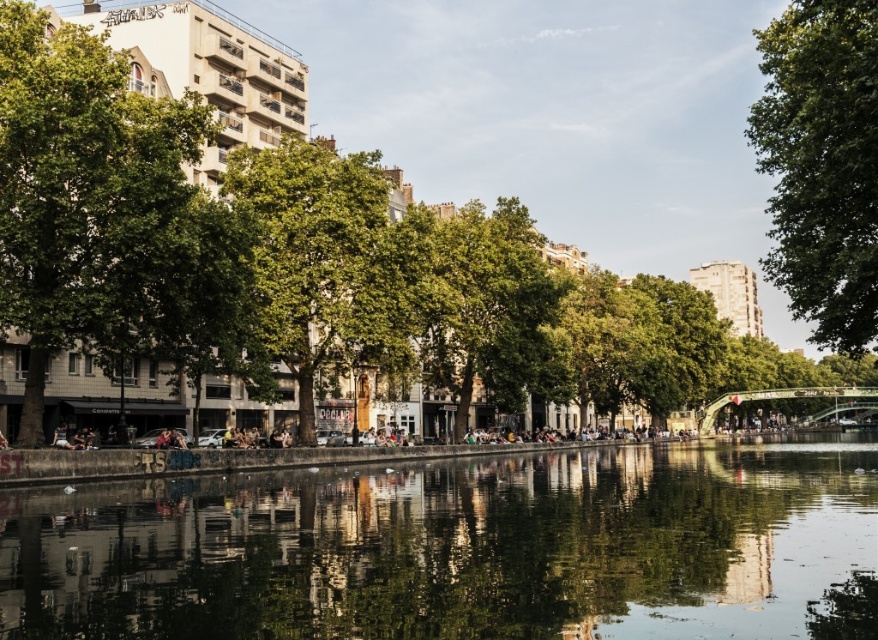
Which of these two, green leafy tree at left or green leafy tree at upper right, stands shorter?

green leafy tree at left

The image size is (878, 640). Describe the element at coordinates (98, 208) in the screenshot. I see `green leafy tree at left` at that location.

Does point (63, 224) come in front of point (839, 198)?

Yes, point (63, 224) is in front of point (839, 198).

Locate an element on the screen. This screenshot has height=640, width=878. green leafy tree at left is located at coordinates (98, 208).

Can you confirm if green reflective water at center is taller than green leafy tree at upper right?

No.

Consider the image. Is green reflective water at center further to camera compared to green leafy tree at upper right?

No.

Locate an element on the screen. Image resolution: width=878 pixels, height=640 pixels. green reflective water at center is located at coordinates pyautogui.click(x=459, y=548).

Which is more to the right, green leafy tree at center or green leafy tree at left?

From the viewer's perspective, green leafy tree at center appears more on the right side.

Find the location of `green leafy tree at center`. green leafy tree at center is located at coordinates (821, 170).

The height and width of the screenshot is (640, 878). Find the location of `green leafy tree at center`. green leafy tree at center is located at coordinates (821, 170).